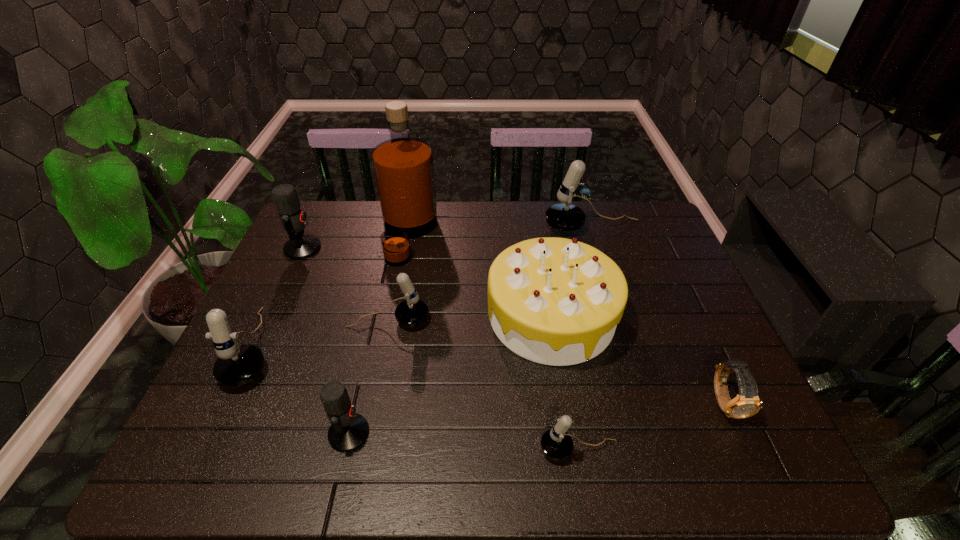
In the image, there is a desktop. Where is `free space at the far left corner`? The height and width of the screenshot is (540, 960). free space at the far left corner is located at coordinates (317, 226).

Identify the location of vacant region at the near left corner. The image size is (960, 540). (196, 448).

In the image, there is a desktop. Where is `vacant space at the far right corner`? vacant space at the far right corner is located at coordinates (645, 213).

Where is `free region at the near right corner`? This screenshot has height=540, width=960. free region at the near right corner is located at coordinates (773, 458).

You are a GUI agent. You are given a task and a screenshot of the screen. Output one action in this format:
    pyautogui.click(x=<x>, y=<y>)
    Task: Click on the empty space between the watch and the third smallest white microphone
    This screenshot has height=540, width=960.
    Given the screenshot: What is the action you would take?
    pyautogui.click(x=491, y=374)

This screenshot has width=960, height=540. What are the coordinates of `empty location between the leftmost white microphone and the right red microphone` in the screenshot? It's located at (303, 390).

This screenshot has width=960, height=540. In order to click on free spot between the nearest white microphone and the birthday cake in this screenshot , I will do `click(565, 382)`.

Image resolution: width=960 pixels, height=540 pixels. In order to click on free space between the tallest object and the second biggest white microphone in this screenshot , I will do `click(333, 291)`.

This screenshot has width=960, height=540. Identify the location of free spot between the leftmost white microphone and the watch. (491, 374).

The width and height of the screenshot is (960, 540). I want to click on vacant area that lies between the shortest microphone and the gold watch, so click(652, 426).